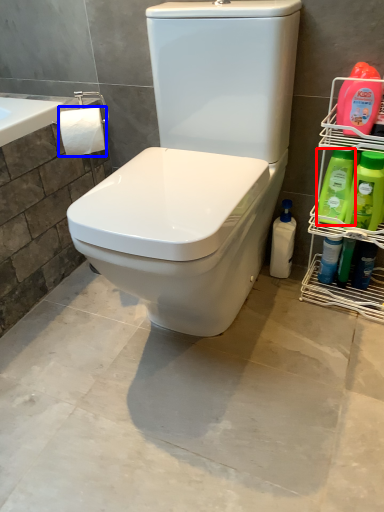
Question: Which of the following is the farthest to the observer, cleaning product (highlighted by a red box) or toilet paper (highlighted by a blue box)?

Choices:
 (A) cleaning product
 (B) toilet paper

Answer: (B)